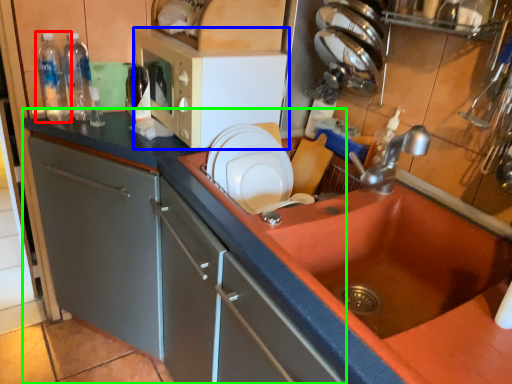
Question: Which object is positioned farthest from bottle (highlighted by a red box)? Select from microwave oven (highlighted by a blue box) and countertop (highlighted by a green box).

Choices:
 (A) microwave oven
 (B) countertop

Answer: (B)